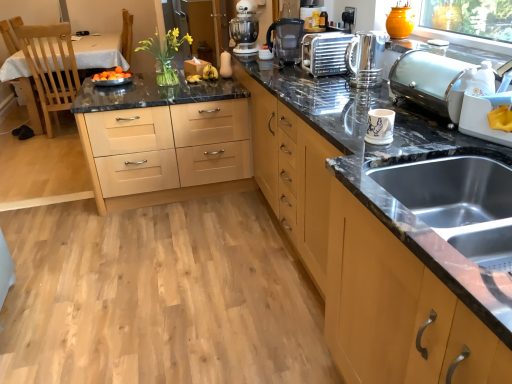
Question: Does satin silver toaster at upper center, the 3th appliance viewed from the right, have a greater width compared to satin silver toaster at upper right, marked as the third appliance in a left-to-right arrangement?

Choices:
 (A) no
 (B) yes

Answer: (B)

Question: Does satin silver toaster at upper center, arranged as the 1th appliance when viewed from the left, appear on the right side of satin silver toaster at upper right, the 2th appliance in the back-to-front sequence?

Choices:
 (A) yes
 (B) no

Answer: (B)

Question: Does satin silver toaster at upper center, the 1th appliance when ordered from back to front, have a lesser height compared to satin silver toaster at upper right, marked as the third appliance in a left-to-right arrangement?

Choices:
 (A) yes
 (B) no

Answer: (B)

Question: Is satin silver toaster at upper right, the 2th appliance in the back-to-front sequence, at the back of satin silver toaster at upper center, arranged as the 1th appliance when viewed from the left?

Choices:
 (A) no
 (B) yes

Answer: (A)

Question: Are satin silver toaster at upper center, placed as the 3th appliance when sorted from front to back, and satin silver toaster at upper right, the 2th appliance in the back-to-front sequence, far apart?

Choices:
 (A) no
 (B) yes

Answer: (A)

Question: From the image's perspective, is matte brown cabinet at lower right located above or below wooden table at left?

Choices:
 (A) below
 (B) above

Answer: (A)

Question: Would you say matte brown cabinet at lower right is inside or outside wooden table at left?

Choices:
 (A) outside
 (B) inside

Answer: (A)

Question: Is matte brown cabinet at lower right bigger or smaller than wooden table at left?

Choices:
 (A) small
 (B) big

Answer: (A)

Question: Considering the positions of point (351, 221) and point (83, 44), is point (351, 221) closer or farther from the camera than point (83, 44)?

Choices:
 (A) closer
 (B) farther

Answer: (A)

Question: Looking at their shapes, would you say satin silver toaster at upper right, marked as the third appliance in a left-to-right arrangement, is wider or thinner than black plastic coffee machine at center?

Choices:
 (A) thin
 (B) wide

Answer: (B)

Question: Considering the positions of satin silver toaster at upper right, marked as the third appliance in a left-to-right arrangement, and black plastic coffee machine at center in the image, is satin silver toaster at upper right, marked as the third appliance in a left-to-right arrangement, bigger or smaller than black plastic coffee machine at center?

Choices:
 (A) small
 (B) big

Answer: (B)

Question: Is point (424, 94) positioned closer to the camera than point (276, 34)?

Choices:
 (A) closer
 (B) farther

Answer: (A)

Question: From a real-world perspective, is satin silver toaster at upper right, the 2th appliance viewed from the top, positioned above or below black plastic coffee machine at center?

Choices:
 (A) above
 (B) below

Answer: (B)

Question: Looking at their shapes, would you say white ceramic mug at upper right, the first appliance from the front, is wider or thinner than wooden table at left?

Choices:
 (A) thin
 (B) wide

Answer: (A)

Question: From a real-world perspective, is white ceramic mug at upper right, which appears as the second appliance when viewed from the right, positioned above or below wooden table at left?

Choices:
 (A) above
 (B) below

Answer: (A)